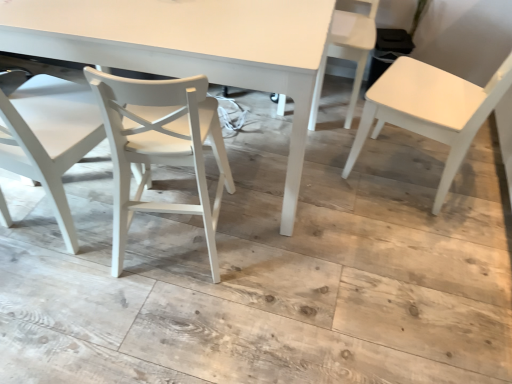
This screenshot has height=384, width=512. What are the coordinates of `free space on the front side of white matte chair at left, marked as the first chair in a left-to-right arrangement` in the screenshot? It's located at (65, 301).